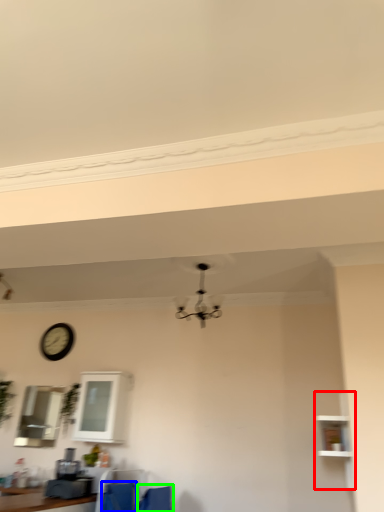
Question: Which object is positioned farthest from shelf (highlighted by a red box)? Select from feeding chair (highlighted by a blue box) and armchair (highlighted by a green box).

Choices:
 (A) feeding chair
 (B) armchair

Answer: (A)